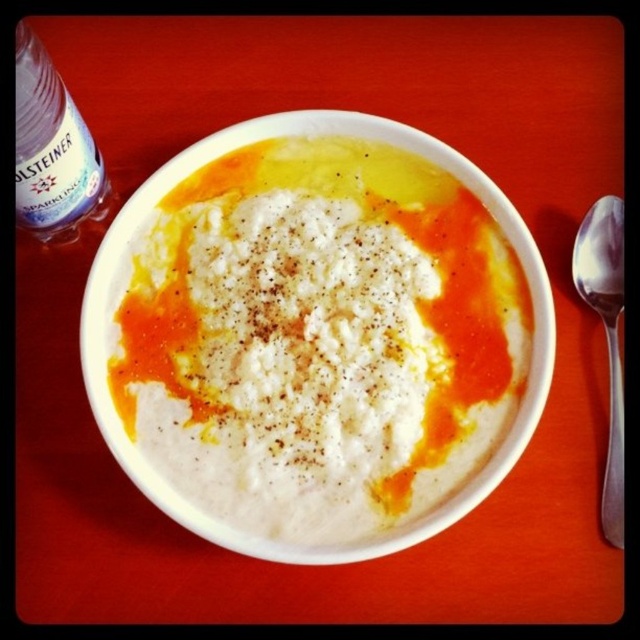
Find the location of a particular element. white creamy soup at center is located at coordinates point(320,337).

Which is above, white creamy soup at center or transparent plastic bottle at upper left?

transparent plastic bottle at upper left

Between point (440, 269) and point (92, 188), which one is positioned in front?

Positioned in front is point (92, 188).

You are a GUI agent. You are given a task and a screenshot of the screen. Output one action in this format:
    pyautogui.click(x=<x>, y=<y>)
    Task: Click on the white creamy soup at center
    
    Given the screenshot: What is the action you would take?
    pyautogui.click(x=320, y=337)

Which is above, transparent plastic bottle at upper left or satin silver spoon at right?

transparent plastic bottle at upper left

Is transparent plastic bottle at upper left taller than satin silver spoon at right?

No.

What do you see at coordinates (51, 148) in the screenshot? I see `transparent plastic bottle at upper left` at bounding box center [51, 148].

Find the location of `transparent plastic bottle at upper left`. transparent plastic bottle at upper left is located at coordinates (51, 148).

Looking at this image, can you confirm if white creamy soup at center is positioned to the right of satin silver spoon at right?

No, white creamy soup at center is not to the right of satin silver spoon at right.

Can you confirm if white creamy soup at center is shorter than satin silver spoon at right?

No.

In the scene shown: Who is more forward, (292,428) or (618,532)?

Point (618,532) is in front.

This screenshot has height=640, width=640. I want to click on white creamy soup at center, so pos(320,337).